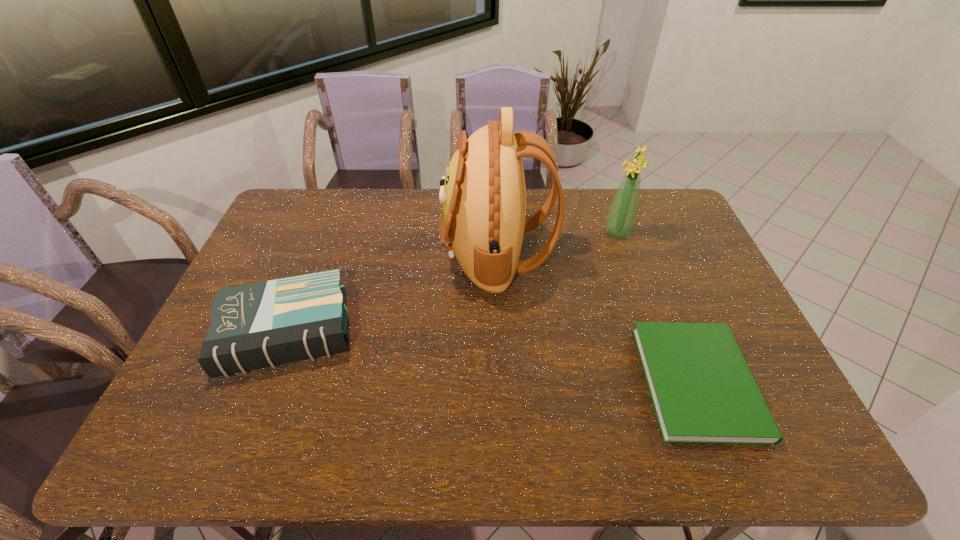
I want to click on object situated at the near right corner, so click(x=703, y=392).

This screenshot has width=960, height=540. In the image, there is a desktop. Find the location of `vacant space at the far edge`. vacant space at the far edge is located at coordinates (352, 206).

You are a GUI agent. You are given a task and a screenshot of the screen. Output one action in this format:
    pyautogui.click(x=<x>, y=<y>)
    Task: Click on the vacant space at the near edge of the desktop
    Image resolution: width=960 pixels, height=540 pixels.
    Given the screenshot: What is the action you would take?
    pyautogui.click(x=320, y=442)

Where is `vacant space at the right edge of the desktop`? The width and height of the screenshot is (960, 540). vacant space at the right edge of the desktop is located at coordinates (730, 316).

This screenshot has width=960, height=540. Find the location of `vacant space at the far right corner of the desktop`. vacant space at the far right corner of the desktop is located at coordinates (653, 204).

This screenshot has width=960, height=540. I want to click on free space at the near right corner of the desktop, so click(x=768, y=446).

The height and width of the screenshot is (540, 960). What are the coordinates of `vacant space that is in between the right paperback book and the bouquet` in the screenshot? It's located at (658, 307).

Image resolution: width=960 pixels, height=540 pixels. I want to click on blank region between the left paperback book and the second tallest object, so click(x=452, y=282).

Locate an element on the screen. empty space between the backpack and the bouquet is located at coordinates (557, 243).

Image resolution: width=960 pixels, height=540 pixels. I want to click on empty location between the taller paperback book and the shorter paperback book, so click(x=492, y=357).